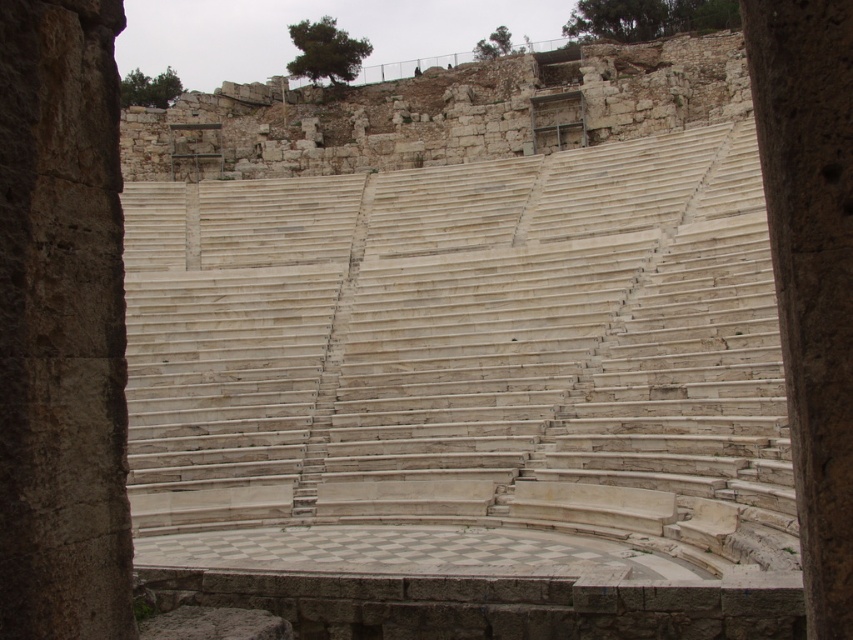
Who is taller, smooth stone pillar at left or smooth stone pillar at center?

smooth stone pillar at center

Who is more forward, [6,541] or [763,76]?

Point [763,76] is in front.

Measure the distance between point (42,8) and camera.

Point (42,8) is 17.77 meters from camera.

In order to click on smooth stone pillar at left in this screenshot , I will do `click(61, 324)`.